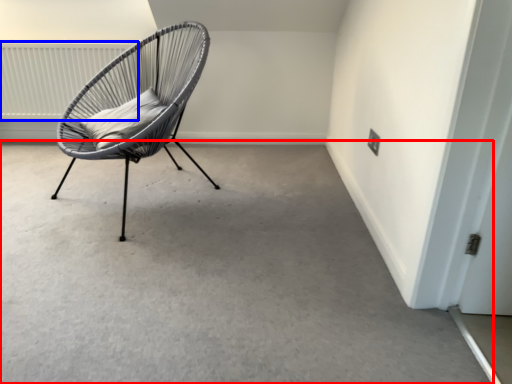
Question: Which object appears farthest to the camera in this image, concrete (highlighted by a red box) or radiator (highlighted by a blue box)?

Choices:
 (A) concrete
 (B) radiator

Answer: (B)